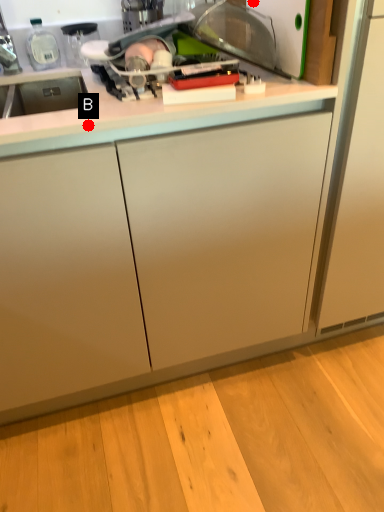
Question: Two points are circled on the image, labeled by A and B beside each circle. Which point is further to the camera?

Choices:
 (A) A is further
 (B) B is further

Answer: (A)